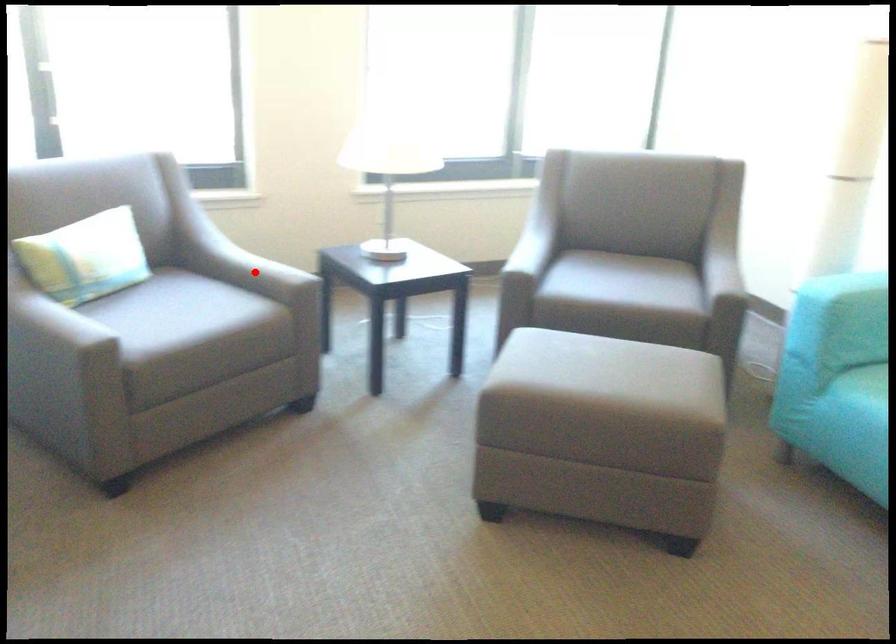
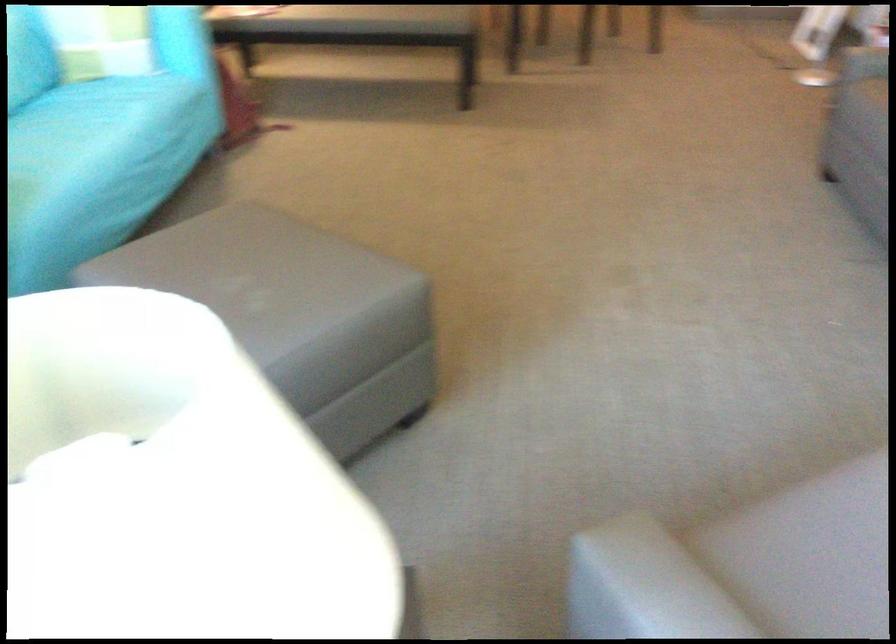
Locate, in the second image, the point that corresponds to the highlighted location in the first image.

(665, 583)